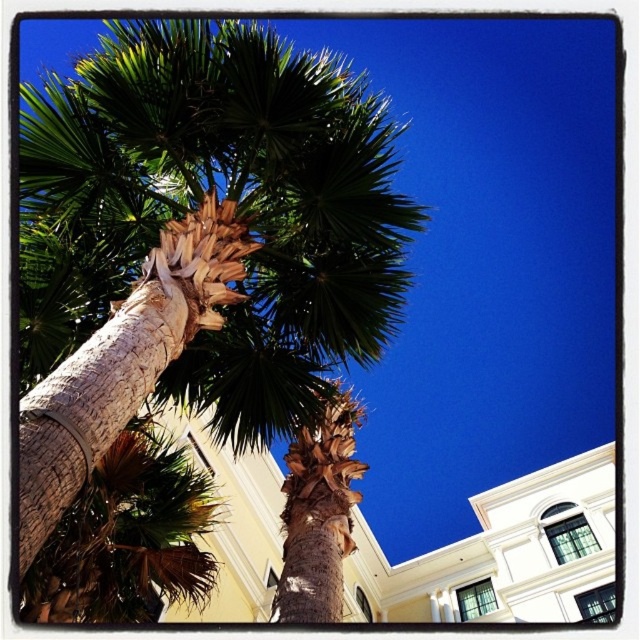
Question: Which point is farther to the camera?

Choices:
 (A) green leafy palm tree at center
 (B) brown textured bark at center

Answer: (B)

Question: Is green leafy palm tree at center bigger than brown textured bark at center?

Choices:
 (A) yes
 (B) no

Answer: (A)

Question: Is green leafy palm tree at center above brown textured bark at center?

Choices:
 (A) no
 (B) yes

Answer: (B)

Question: Which of the following is the farthest from the observer?

Choices:
 (A) click(x=125, y=339)
 (B) click(x=300, y=429)

Answer: (B)

Question: Can you confirm if green leafy palm tree at center is smaller than brown textured bark at center?

Choices:
 (A) yes
 (B) no

Answer: (B)